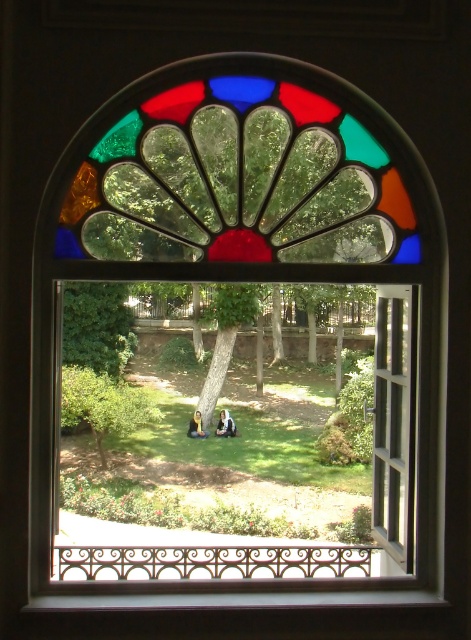
Question: Estimate the real-world distances between objects in this image. Which object is farther from the white fabric person at center?

Choices:
 (A) light brown hair at center
 (B) green leafy tree at center
 (C) smooth brown tree trunk at center

Answer: (B)

Question: Which point is closer to the camera?

Choices:
 (A) (254, 289)
 (B) (202, 428)
 (C) (227, 428)

Answer: (B)

Question: Considering the relative positions of green leafy tree at center and light brown hair at center in the image provided, where is green leafy tree at center located with respect to light brown hair at center?

Choices:
 (A) above
 (B) below

Answer: (A)

Question: Estimate the real-world distances between objects in this image. Which object is farther from the green leafy tree at center?

Choices:
 (A) white fabric person at center
 (B) light brown hair at center

Answer: (A)

Question: Is green leafy tree at center smaller than white fabric person at center?

Choices:
 (A) no
 (B) yes

Answer: (A)

Question: Does smooth brown tree trunk at center come behind light brown hair at center?

Choices:
 (A) no
 (B) yes

Answer: (B)